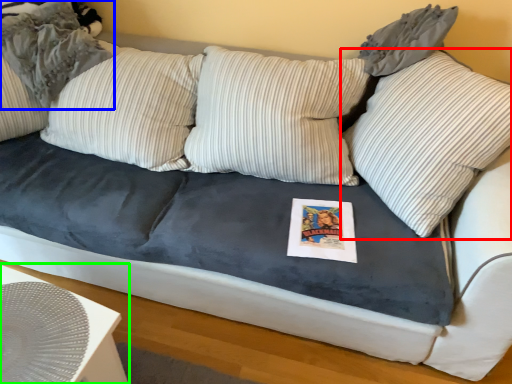
Question: Considering the real-world distances, which object is closest to pillow (highlighted by a red box)? pillow (highlighted by a blue box) or table (highlighted by a green box).

Choices:
 (A) pillow
 (B) table

Answer: (B)